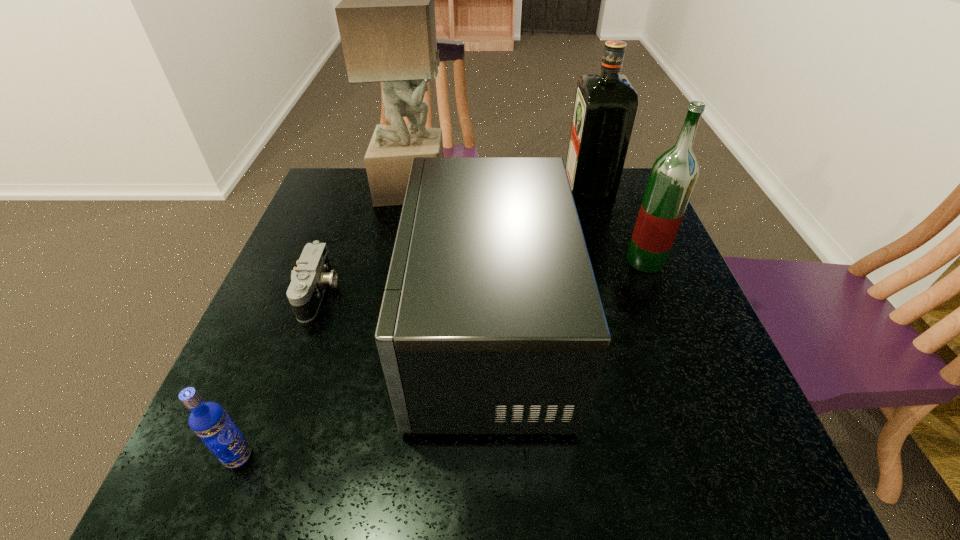
The image size is (960, 540). What are the coordinates of `free space between the nearer liquor and the farther liquor` in the screenshot? It's located at pos(616,225).

Find the location of a particular element. free space that is in between the vodka and the fourth tallest object is located at coordinates (362, 394).

Where is `empty space that is in between the farther liquor and the nearer liquor`? Image resolution: width=960 pixels, height=540 pixels. empty space that is in between the farther liquor and the nearer liquor is located at coordinates (616, 225).

Identify which object is located as the third nearest to the third shortest object. Please provide its 2D coordinates. Your answer should be formatted as a tuple, i.e. [(x, y)], where the tuple contains the x and y coordinates of a point satisfying the conditions above.

[(386, 19)]

Find the location of `the second closest object to the shortest object`. the second closest object to the shortest object is located at coordinates (386, 19).

The width and height of the screenshot is (960, 540). I want to click on free space that satisfies the following two spatial constraints: 1. on the front label of the nearer liquor; 2. on the left side of the farther liquor, so click(x=612, y=261).

I want to click on vacant region that satisfies the following two spatial constraints: 1. on the front-facing side of the tallest object; 2. on the right side of the nearer liquor, so click(x=398, y=261).

Where is `vacant space that satisfies the following two spatial constraints: 1. on the back side of the nearer liquor; 2. on the right side of the nearest object`? This screenshot has height=540, width=960. vacant space that satisfies the following two spatial constraints: 1. on the back side of the nearer liquor; 2. on the right side of the nearest object is located at coordinates (316, 261).

Locate an element on the screen. The width and height of the screenshot is (960, 540). vacant space that satisfies the following two spatial constraints: 1. on the front label of the farther liquor; 2. on the front side of the vodka is located at coordinates (673, 456).